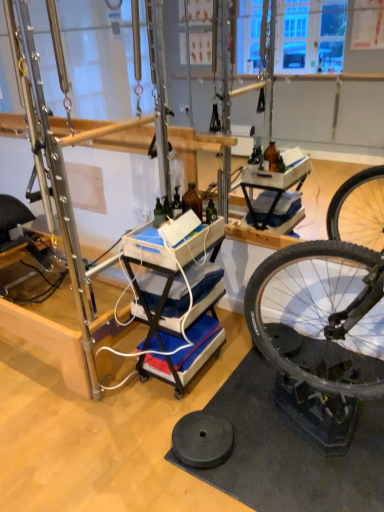
Image resolution: width=384 pixels, height=512 pixels. I want to click on free location to the right of wooden tray at center, so click(x=243, y=373).